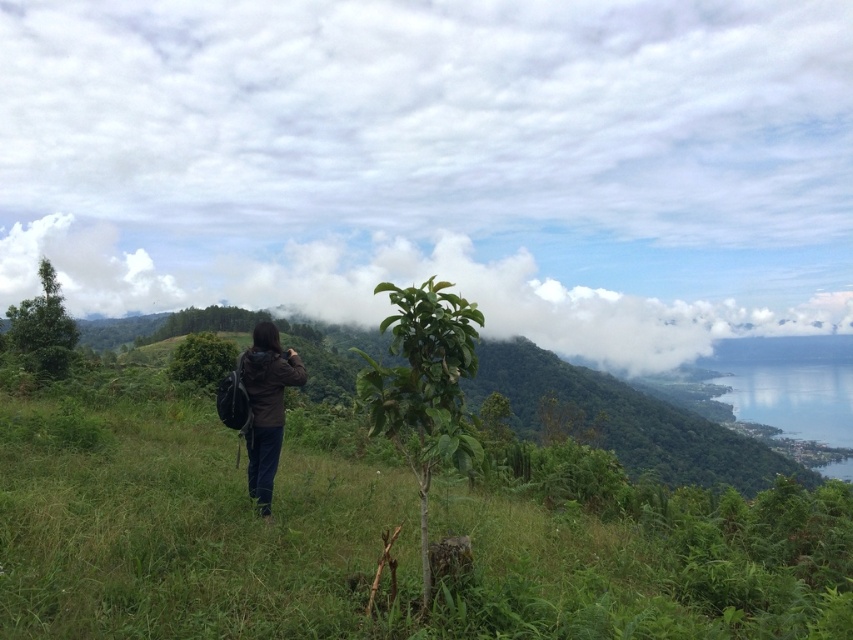
Question: Among these points, which one is nearest to the camera?

Choices:
 (A) (389, 257)
 (B) (25, 300)
 (C) (264, 330)
 (D) (196, 358)

Answer: (C)

Question: Which point is closer to the camera?

Choices:
 (A) (212, 285)
 (B) (216, 369)

Answer: (B)

Question: Can you confirm if brown leather jacket at center is positioned below green leafy bush at center?

Choices:
 (A) no
 (B) yes

Answer: (A)

Question: Does white fluffy cloud at upper center appear on the left side of brown leather jacket at center?

Choices:
 (A) yes
 (B) no

Answer: (B)

Question: Observing the image, what is the correct spatial positioning of green leafy tree at left in reference to green leafy bush at center?

Choices:
 (A) below
 (B) above

Answer: (B)

Question: Estimate the real-world distances between objects in this image. Which object is closer to the brown leather jacket at center?

Choices:
 (A) green leafy tree at center
 (B) white fluffy cloud at upper center

Answer: (A)